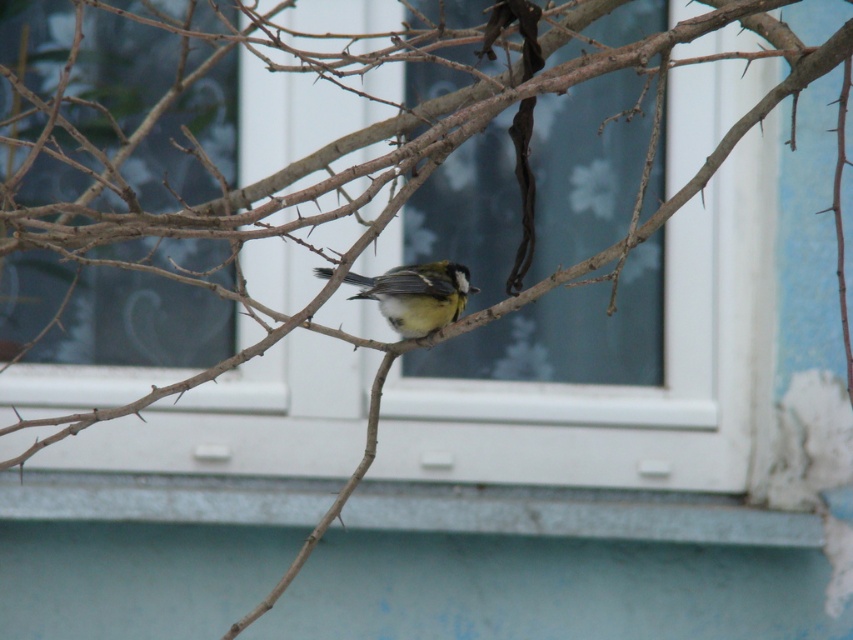
You are standing in a room with a window and a thorny bush. You notice a specific point at coordinates point (576, 513). Based on the scene, what object or material is located at this point?

The point (576, 513) corresponds to blue painted wood at lower center according to the description.

You are an interior designer working on a project. You need to place a decorative item exactly at the center of the blue painted wood at lower center. What coordinates should you use for the center point?

The center point of the blue painted wood at lower center should be at coordinates (x=576, y=513).